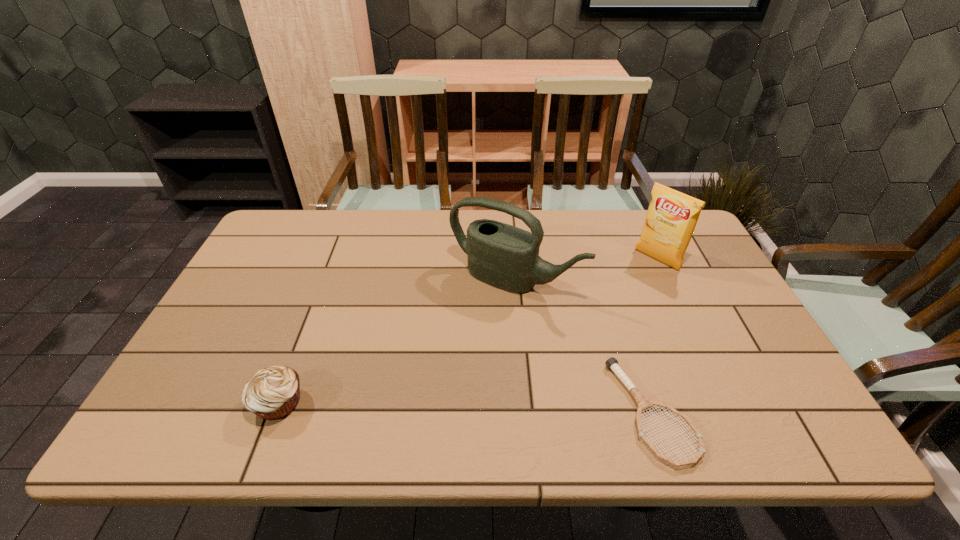
Find the location of `free space between the shortest object and the third object from right to left`. free space between the shortest object and the third object from right to left is located at coordinates (583, 346).

Image resolution: width=960 pixels, height=540 pixels. In order to click on free space between the second shortest object and the second object from left to right in this screenshot , I will do `click(396, 342)`.

You are a GUI agent. You are given a task and a screenshot of the screen. Output one action in this format:
    pyautogui.click(x=<x>, y=<y>)
    Task: Click on the vacant region between the rightmost object and the tennis racket
    
    Given the screenshot: What is the action you would take?
    pyautogui.click(x=654, y=335)

Find the location of a particular element. The height and width of the screenshot is (540, 960). vacant space that's between the leftmost object and the second object from left to right is located at coordinates (396, 342).

At what (x,y) coordinates should I click in order to perform the action: click on blank region between the crisp (potato chip) and the watering can. Please return your answer as a coordinate pair (x, y). The width and height of the screenshot is (960, 540). Looking at the image, I should click on (586, 270).

You are a GUI agent. You are given a task and a screenshot of the screen. Output one action in this format:
    pyautogui.click(x=<x>, y=<y>)
    Task: Click on the free point between the muffin and the rightmost object
    This screenshot has height=540, width=960.
    Given the screenshot: What is the action you would take?
    [x=468, y=331]

Identify which object is the nearest to the crisp (potato chip). Please provide its 2D coordinates. Your answer should be formatted as a tuple, i.e. [(x, y)], where the tuple contains the x and y coordinates of a point satisfying the conditions above.

[(502, 255)]

The width and height of the screenshot is (960, 540). What are the coordinates of `object that is the third closest to the second object from left to right` in the screenshot? It's located at click(x=272, y=393).